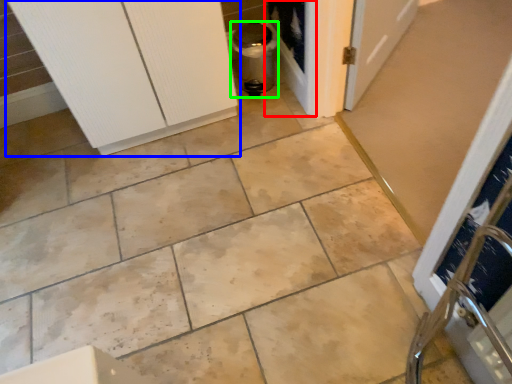
Question: Which object is positioned closest to screen door (highlighted by a red box)? Select from door (highlighted by a blue box) and appliance (highlighted by a green box).

Choices:
 (A) door
 (B) appliance

Answer: (B)